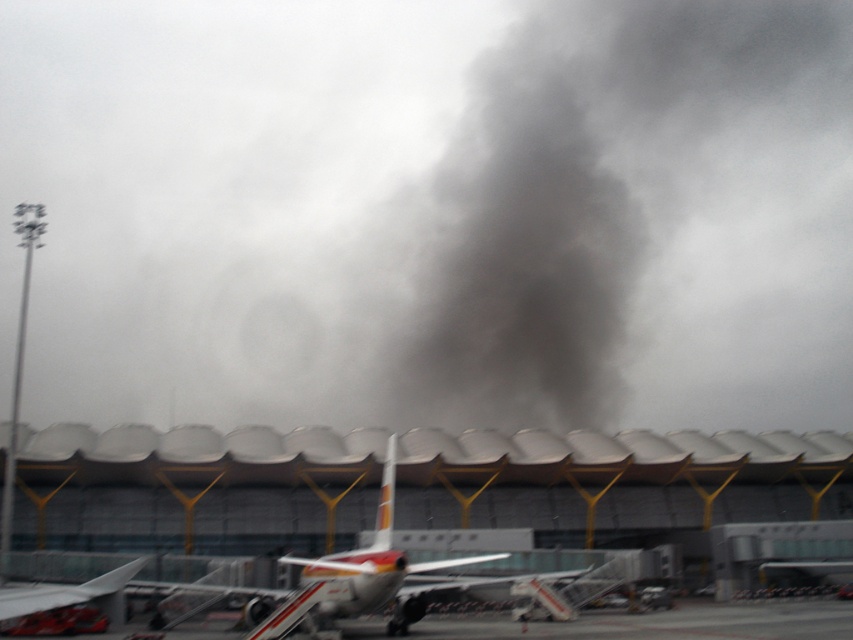
Does black smoke at upper center appear on the right side of metallic silver airplane at center?

In fact, black smoke at upper center is to the left of metallic silver airplane at center.

Does black smoke at upper center have a smaller size compared to metallic silver airplane at center?

No, black smoke at upper center is not smaller than metallic silver airplane at center.

Does point (268, 346) lie behind point (412, 593)?

Yes, it is.

I want to click on black smoke at upper center, so click(430, 212).

Is black smoke at upper center closer to the viewer compared to dark gray smoke at center?

Yes, it is.

Can you confirm if black smoke at upper center is positioned to the left of dark gray smoke at center?

Correct, you'll find black smoke at upper center to the left of dark gray smoke at center.

Is point (421, 228) farther from camera compared to point (416, 321)?

Yes, point (421, 228) is farther from viewer.

You are a GUI agent. You are given a task and a screenshot of the screen. Output one action in this format:
    pyautogui.click(x=<x>, y=<y>)
    Task: Click on the black smoke at upper center
    
    Given the screenshot: What is the action you would take?
    pyautogui.click(x=430, y=212)

Can you confirm if dark gray smoke at center is smaller than metallic silver airplane at center?

No.

Is dark gray smoke at center wider than metallic silver airplane at center?

Yes.

Looking at this image, who is more forward, (x=550, y=349) or (x=380, y=593)?

Positioned in front is point (x=380, y=593).

The image size is (853, 640). Identify the location of dark gray smoke at center. tap(524, 248).